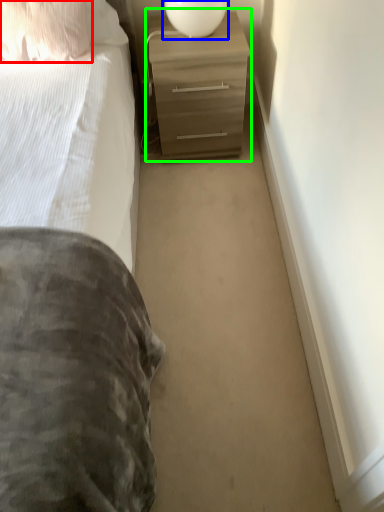
Question: Which is farther away from pillow (highlighted by a red box)? table lamp (highlighted by a blue box) or chest of drawers (highlighted by a green box)?

Choices:
 (A) table lamp
 (B) chest of drawers

Answer: (A)